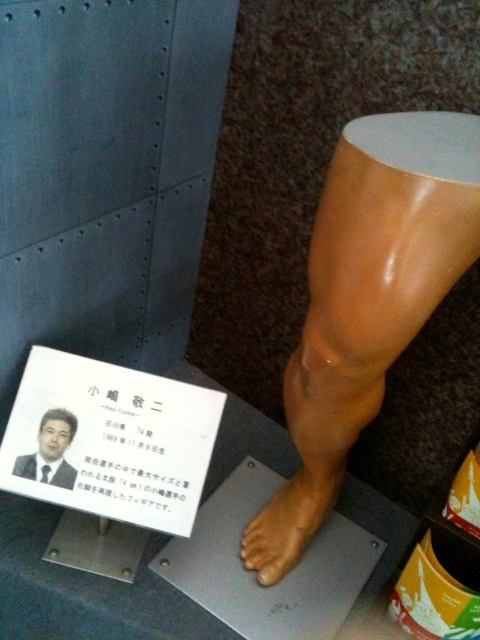
Question: Can you confirm if matte brown foot at lower center is wider than matte black photo frame at lower left?

Choices:
 (A) yes
 (B) no

Answer: (A)

Question: Is matte brown foot at lower center wider than matte black photo frame at lower left?

Choices:
 (A) no
 (B) yes

Answer: (B)

Question: Among these objects, which one is farthest from the camera?

Choices:
 (A) matte brown foot at lower center
 (B) matte black photo frame at lower left

Answer: (A)

Question: Among these objects, which one is nearest to the camera?

Choices:
 (A) matte black photo frame at lower left
 (B) matte brown foot at lower center

Answer: (A)

Question: Can you confirm if matte brown foot at lower center is positioned above matte black photo frame at lower left?

Choices:
 (A) yes
 (B) no

Answer: (B)

Question: Among these objects, which one is farthest from the camera?

Choices:
 (A) matte black photo frame at lower left
 (B) matte brown foot at lower center

Answer: (B)